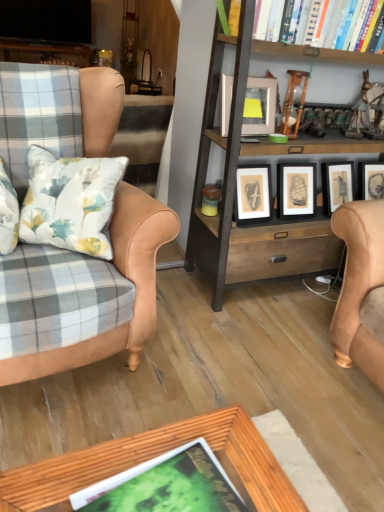
Question: Does green matte book at lower center, placed as the 1th book when sorted from left to right, come in front of hardcover book at upper right, acting as the second book starting from the front?

Choices:
 (A) yes
 (B) no

Answer: (A)

Question: Is green matte book at lower center, placed as the 2th book when sorted from right to left, looking in the opposite direction of hardcover book at upper right, the 1th book viewed from the top?

Choices:
 (A) no
 (B) yes

Answer: (A)

Question: Considering the relative sizes of green matte book at lower center, acting as the second book starting from the back, and hardcover book at upper right, the 1th book viewed from the top, in the image provided, is green matte book at lower center, acting as the second book starting from the back, thinner than hardcover book at upper right, the 1th book viewed from the top,?

Choices:
 (A) yes
 (B) no

Answer: (B)

Question: Considering the relative sizes of green matte book at lower center, placed as the 2th book when sorted from right to left, and hardcover book at upper right, arranged as the 2th book when viewed from the left, in the image provided, is green matte book at lower center, placed as the 2th book when sorted from right to left, smaller than hardcover book at upper right, arranged as the 2th book when viewed from the left,?

Choices:
 (A) no
 (B) yes

Answer: (B)

Question: Is green matte book at lower center, placed as the 2th book when sorted from right to left, to the left of hardcover book at upper right, which is the 1th book from right to left, from the viewer's perspective?

Choices:
 (A) no
 (B) yes

Answer: (B)

Question: Is green matte book at lower center, placed as the 1th book when sorted from left to right, oriented towards hardcover book at upper right, arranged as the 2th book when viewed from the left?

Choices:
 (A) no
 (B) yes

Answer: (A)

Question: Does hardcover book at upper right, the 1th book viewed from the top, have a greater width compared to matte silver picture frame at upper center?

Choices:
 (A) yes
 (B) no

Answer: (A)

Question: Does hardcover book at upper right, which is the 1th book from right to left, lie in front of matte silver picture frame at upper center?

Choices:
 (A) yes
 (B) no

Answer: (A)

Question: Is hardcover book at upper right, placed as the second book when sorted from bottom to top, further to the viewer compared to matte silver picture frame at upper center?

Choices:
 (A) yes
 (B) no

Answer: (B)

Question: Is hardcover book at upper right, the 1th book viewed from the top, facing towards matte silver picture frame at upper center?

Choices:
 (A) no
 (B) yes

Answer: (A)

Question: Is hardcover book at upper right, arranged as the 2th book when viewed from the left, turned away from matte silver picture frame at upper center?

Choices:
 (A) no
 (B) yes

Answer: (A)

Question: Is leather armchair at left shorter than matte silver picture frame at upper center?

Choices:
 (A) no
 (B) yes

Answer: (A)